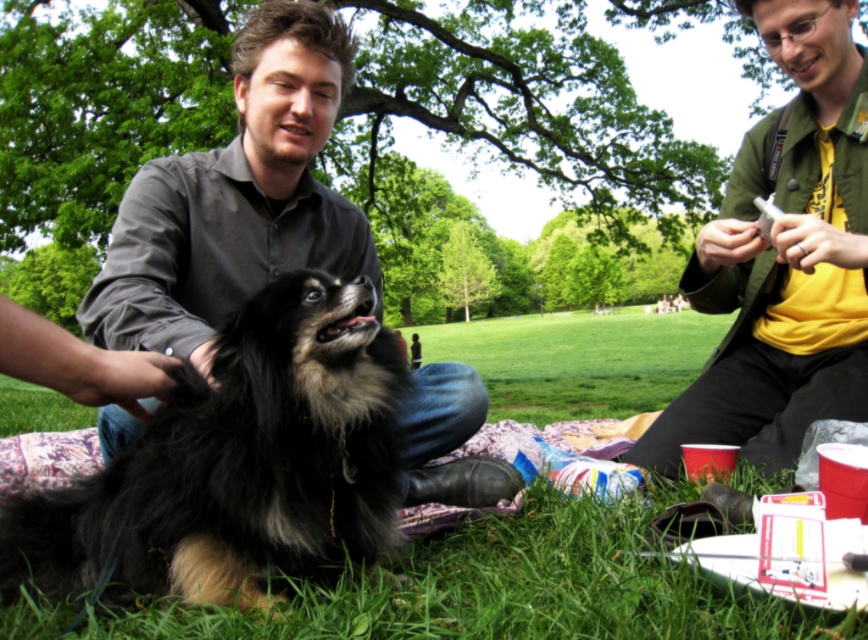
Question: Observing the image, what is the correct spatial positioning of green grass at lower center in reference to yellow cotton shirt at upper right?

Choices:
 (A) above
 (B) below

Answer: (B)

Question: Among these objects, which one is farthest from the camera?

Choices:
 (A) fluffy fur dog at center
 (B) yellow cotton shirt at upper right

Answer: (B)

Question: Does fluffy fur dog at center appear on the right side of dark gray shirt at center?

Choices:
 (A) yes
 (B) no

Answer: (B)

Question: Which object is the closest to the yellow cotton shirt at upper right?

Choices:
 (A) dark gray shirt at center
 (B) green grass at lower center
 (C) green matte jacket at upper right

Answer: (C)

Question: Which object is the farthest from the fluffy fur dog at center?

Choices:
 (A) dark gray shirt at center
 (B) yellow cotton shirt at upper right

Answer: (B)

Question: From the image, what is the correct spatial relationship of green grass at lower center in relation to green matte jacket at upper right?

Choices:
 (A) below
 (B) above

Answer: (A)